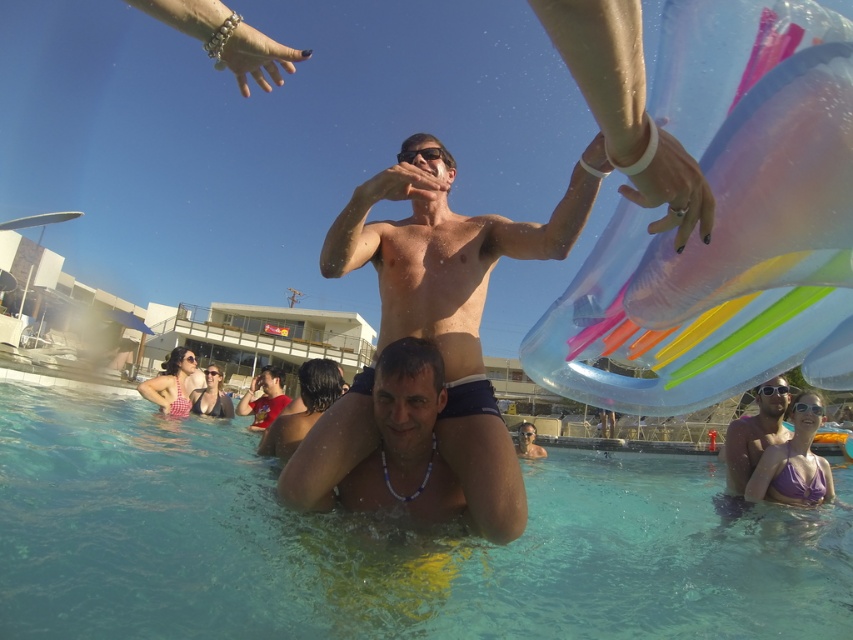
Question: Does clear blue water at center appear over shiny skin man at center?

Choices:
 (A) no
 (B) yes

Answer: (A)

Question: Among these points, which one is farthest from the camera?

Choices:
 (A) (401, 376)
 (B) (131, 596)
 (C) (286, 428)

Answer: (C)

Question: Is beige beaded necklace at center bigger than matte purple swimsuit at lower right?

Choices:
 (A) yes
 (B) no

Answer: (B)

Question: Which of the following is the closest to the observer?

Choices:
 (A) smooth red shirt at center
 (B) shiny skin man at center
 (C) clear blue water at center

Answer: (B)

Question: Based on their relative distances, which object is farther from the beige beaded necklace at center?

Choices:
 (A) smooth red shirt at center
 (B) clear blue water at center

Answer: (A)

Question: Can you confirm if clear blue water at center is positioned to the left of beige beaded necklace at center?

Choices:
 (A) no
 (B) yes

Answer: (B)